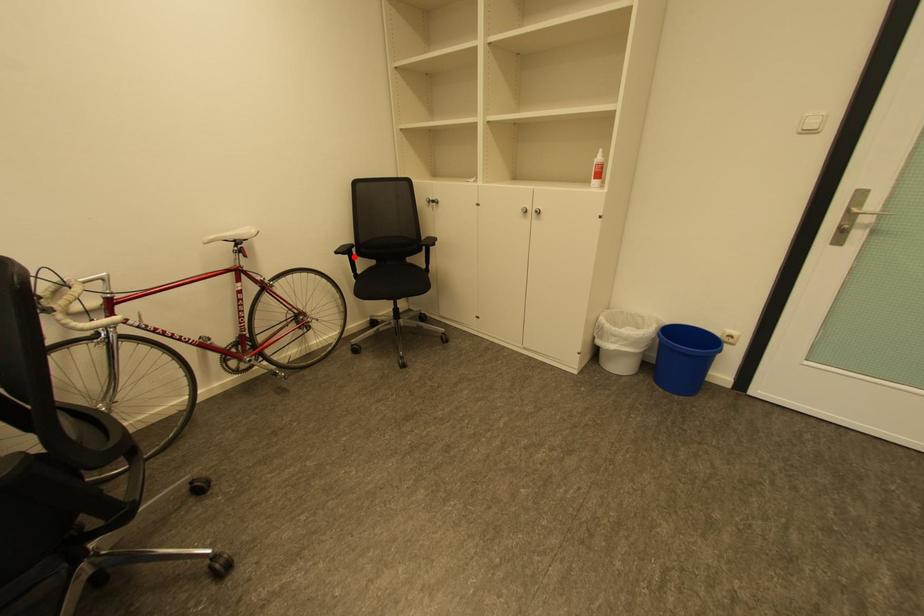
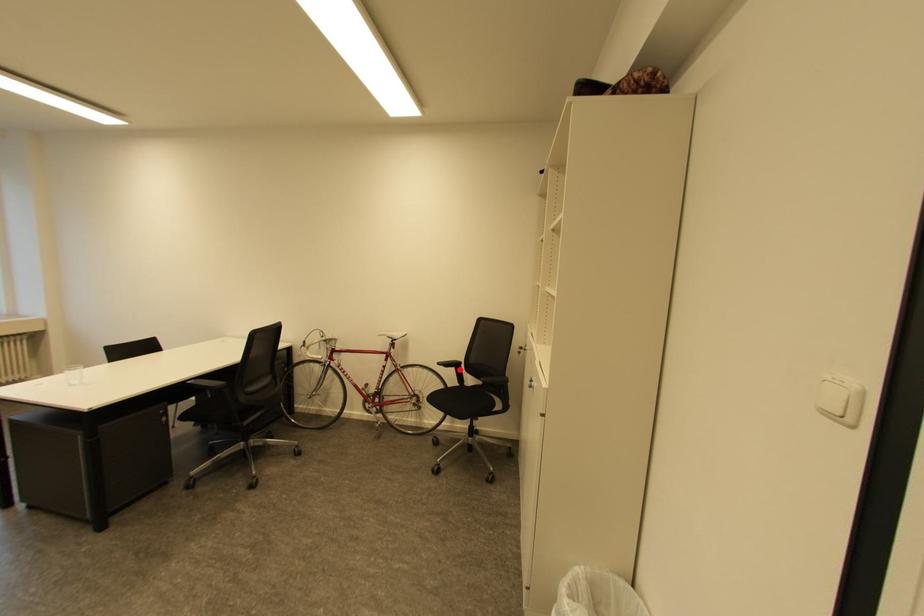
I am providing you with two images of the same scene from different viewpoints. A red point is marked on the first image and another point is marked on the second image. Do the highlighted points in image1 and image2 indicate the same real-world spot?

Yes